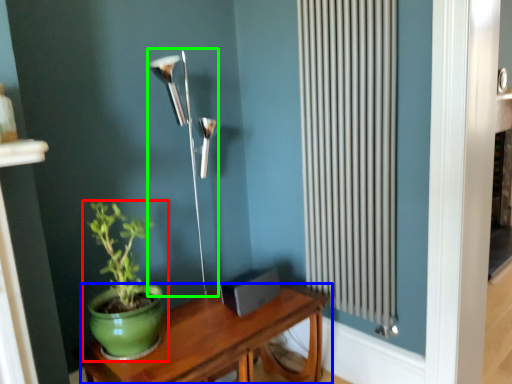
Question: Estimate the real-world distances between objects in this image. Which object is farther from houseplant (highlighted by a red box), table (highlighted by a blue box) or lamp (highlighted by a green box)?

Choices:
 (A) table
 (B) lamp

Answer: (B)